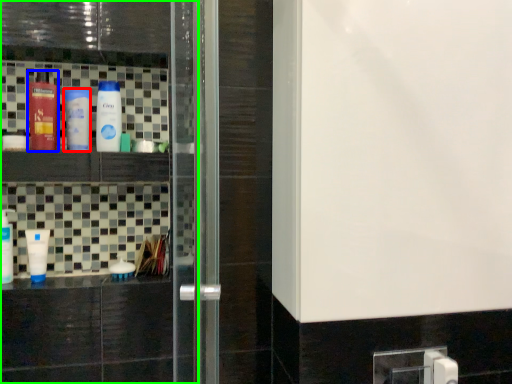
Question: Which object is positioned farthest from bottle (highlighted by a red box)? Select from bottle (highlighted by a blue box) and screen door (highlighted by a green box).

Choices:
 (A) bottle
 (B) screen door

Answer: (B)